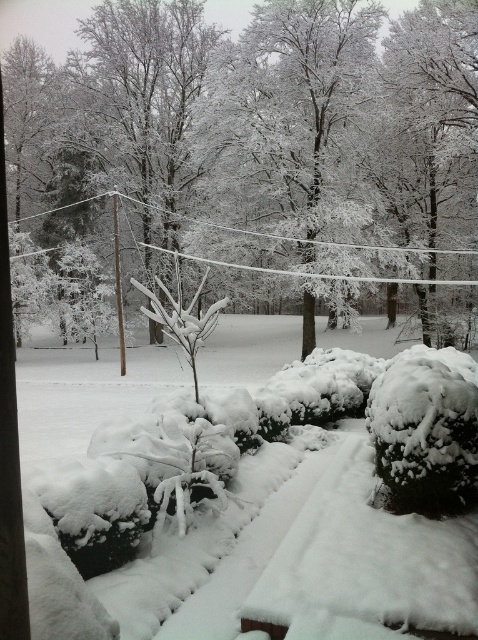
You are standing at the center of the snowy pathway and want to reach the white frosty tree at center. According to the coordinates provided, in which direction should you move relative to your current position?

The white frosty tree at center is located at coordinates point (274,138), so you should move towards the lower left direction from your current position at the center of the snowy pathway.

You are an artist planning to paint the winter scene. You want to ensure the white frosty tree at center and the white fluffy snow at center are proportionally accurate. Which object should you draw wider in your painting?

The white frosty tree at center should be drawn wider than the white fluffy snow at center because the white frosty tree at center is wider than the white fluffy snow at center.